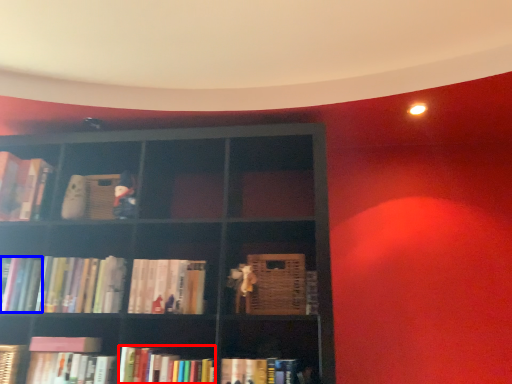
Question: Which object is further to the camera taking this photo, book (highlighted by a red box) or book (highlighted by a blue box)?

Choices:
 (A) book
 (B) book

Answer: (B)